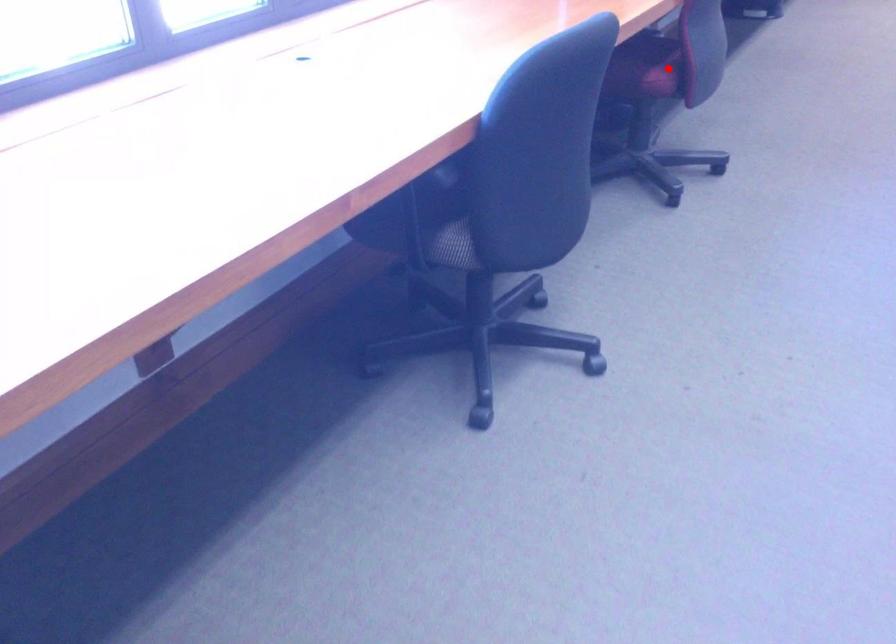
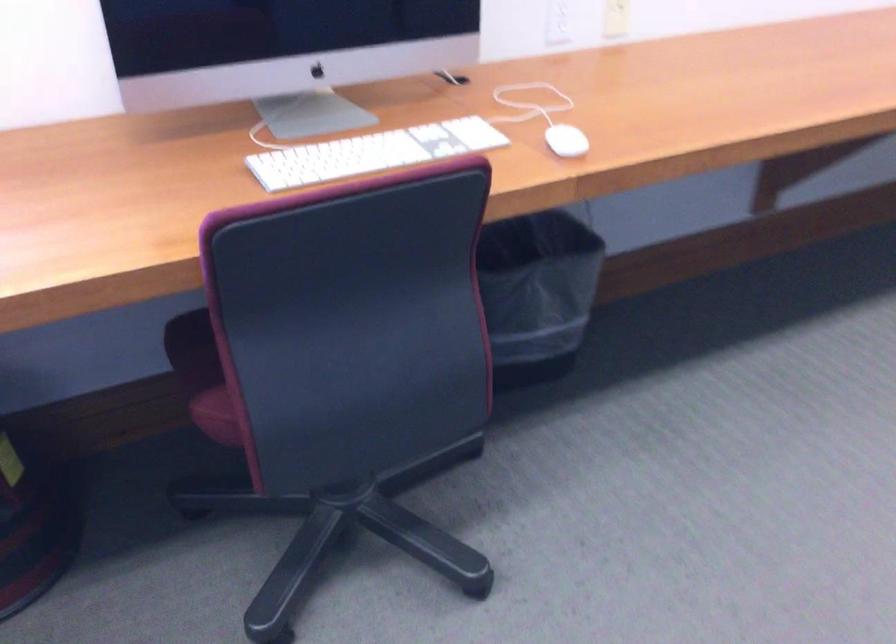
The point at the highlighted location is marked in the first image. Where is the corresponding point in the second image?

(220, 413)